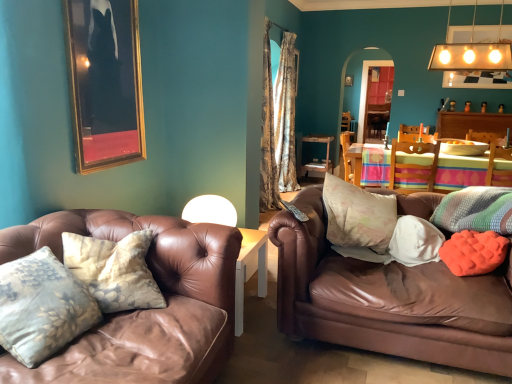
Question: Should I look upward or downward to see orange textured pillow at right, placed as the third pillow when sorted from front to back?

Choices:
 (A) down
 (B) up

Answer: (A)

Question: Is matte white light fixture at upper right, which appears as the second lamp when viewed from the left, positioned behind white fabric pillow at right, arranged as the 4th pillow when viewed from the front?

Choices:
 (A) no
 (B) yes

Answer: (B)

Question: Does matte white light fixture at upper right, which appears as the 1th lamp when viewed from the top, touch white fabric pillow at right, arranged as the 4th pillow when viewed from the front?

Choices:
 (A) no
 (B) yes

Answer: (A)

Question: Is matte white light fixture at upper right, the 2th lamp viewed from the front, aimed at white fabric pillow at right, positioned as the third pillow in back-to-front order?

Choices:
 (A) yes
 (B) no

Answer: (B)

Question: Can you confirm if matte white light fixture at upper right, which is the second lamp from bottom to top, is wider than white fabric pillow at right, arranged as the 4th pillow when viewed from the front?

Choices:
 (A) yes
 (B) no

Answer: (B)

Question: Does matte white light fixture at upper right, which appears as the second lamp when viewed from the left, have a lesser height compared to white fabric pillow at right, which appears as the third pillow when viewed from the left?

Choices:
 (A) no
 (B) yes

Answer: (A)

Question: Can we say matte white light fixture at upper right, which is the first lamp in back-to-front order, lies outside white fabric pillow at right, positioned as the third pillow in back-to-front order?

Choices:
 (A) yes
 (B) no

Answer: (A)

Question: Would you say matte white light fixture at upper right, which is the second lamp from bottom to top, contains wooden table at center, the second table viewed from the back?

Choices:
 (A) yes
 (B) no

Answer: (B)

Question: Considering the relative sizes of matte white light fixture at upper right, the 2th lamp viewed from the front, and wooden table at center, which is the first table in front-to-back order, in the image provided, is matte white light fixture at upper right, the 2th lamp viewed from the front, wider than wooden table at center, which is the first table in front-to-back order,?

Choices:
 (A) no
 (B) yes

Answer: (A)

Question: Can you confirm if matte white light fixture at upper right, the first lamp from the right, is smaller than wooden table at center, which is the first table in front-to-back order?

Choices:
 (A) yes
 (B) no

Answer: (A)

Question: Considering the relative positions of matte white light fixture at upper right, the 2th lamp viewed from the front, and wooden table at center, which is the first table in front-to-back order, in the image provided, is matte white light fixture at upper right, the 2th lamp viewed from the front, behind wooden table at center, which is the first table in front-to-back order,?

Choices:
 (A) no
 (B) yes

Answer: (B)

Question: Does matte white light fixture at upper right, which is the first lamp in back-to-front order, appear on the right side of wooden table at center, which is the first table in front-to-back order?

Choices:
 (A) yes
 (B) no

Answer: (A)

Question: Is matte white light fixture at upper right, the 2th lamp viewed from the front, oriented away from wooden table at center, which is the first table in front-to-back order?

Choices:
 (A) yes
 (B) no

Answer: (B)

Question: Would you say wooden table at center, which is the first table in front-to-back order, is outside brown leather couch at right?

Choices:
 (A) no
 (B) yes

Answer: (B)